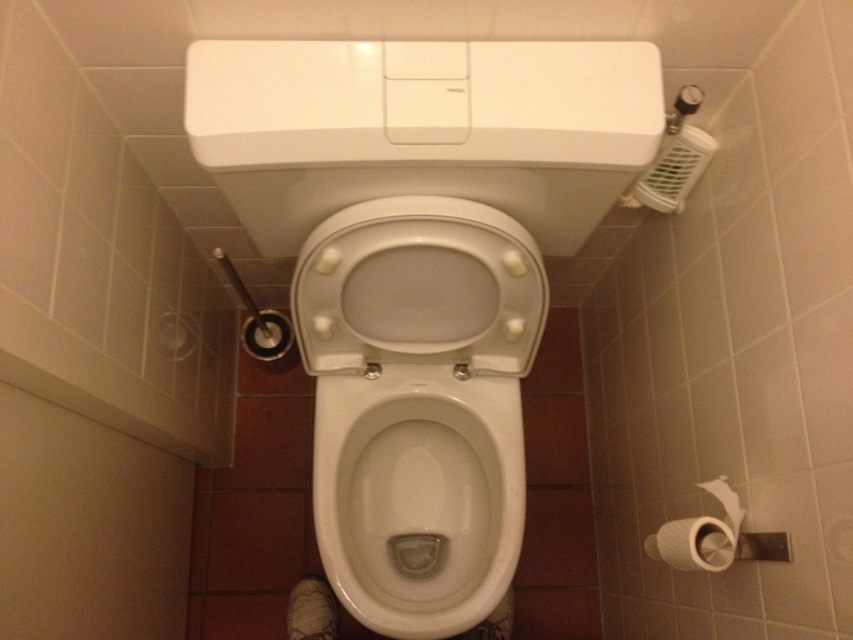
From the picture: Which of these two, white glossy toilet bowl at center or white matte toilet paper at lower right, stands taller?

With more height is white glossy toilet bowl at center.

From the picture: How distant is white glossy toilet bowl at center from white matte toilet paper at lower right?

The distance of white glossy toilet bowl at center from white matte toilet paper at lower right is 14.15 inches.

The height and width of the screenshot is (640, 853). I want to click on white glossy toilet bowl at center, so click(418, 496).

Locate an element on the screen. This screenshot has height=640, width=853. white glossy toilet bowl at center is located at coordinates (418, 496).